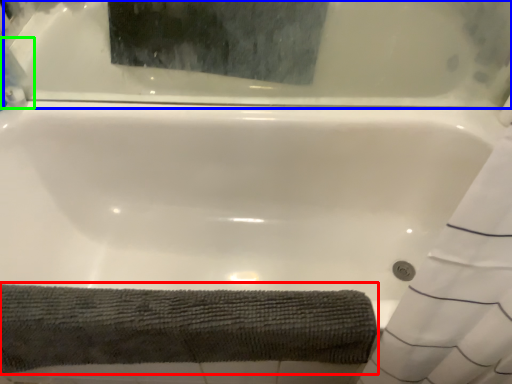
Question: Considering the real-world distances, which object is closest to bath towel (highlighted by a red box)? bathtub (highlighted by a blue box) or cleaning product (highlighted by a green box).

Choices:
 (A) bathtub
 (B) cleaning product

Answer: (A)